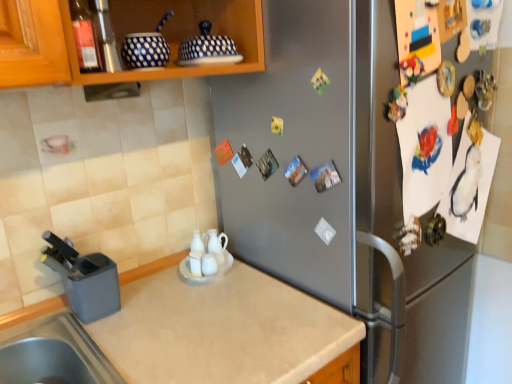
Locate an element on the screen. The image size is (512, 384). free space in front of white glossy tea pot at center is located at coordinates (219, 299).